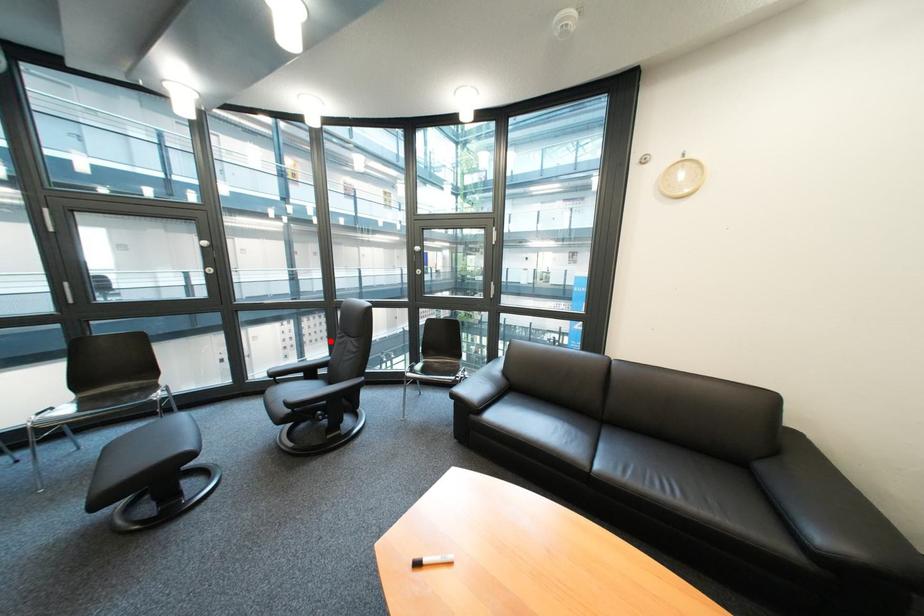
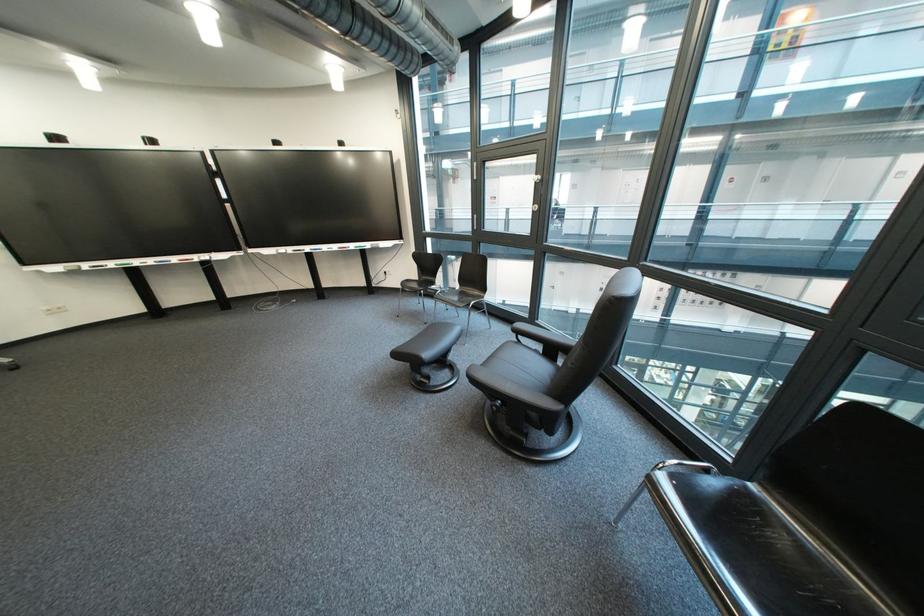
Question: I am providing you with two images of the same scene from different viewpoints. A red point is marked on the first image. Can you still see the location of the red point in image 2?

Choices:
 (A) Yes
 (B) No

Answer: (A)